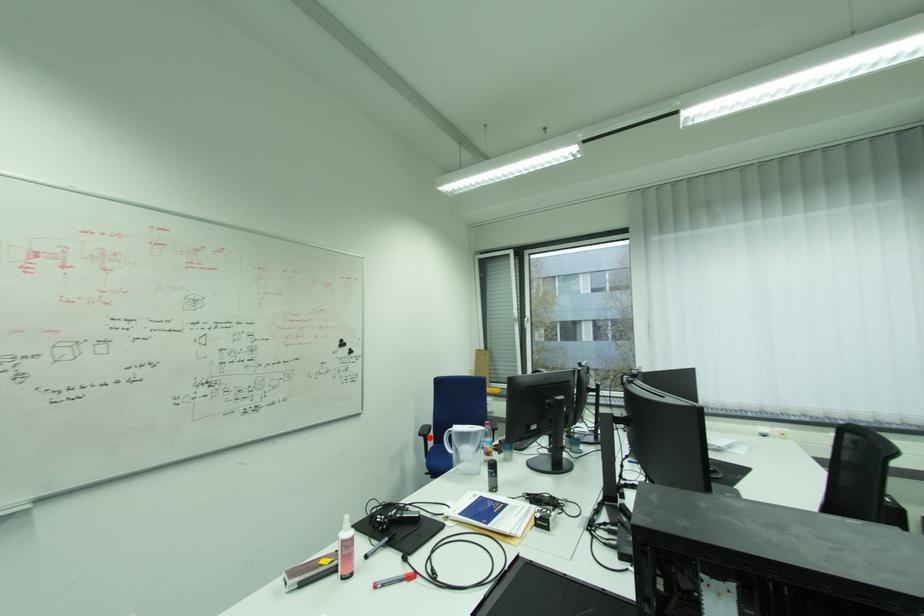
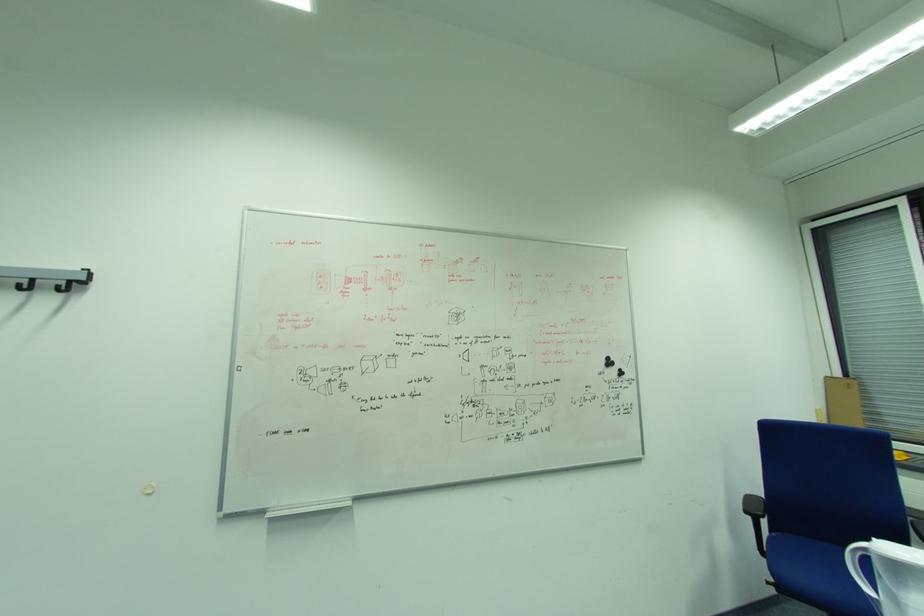
In the second image, find the point that corresponds to the highlighted location in the first image.

(757, 517)